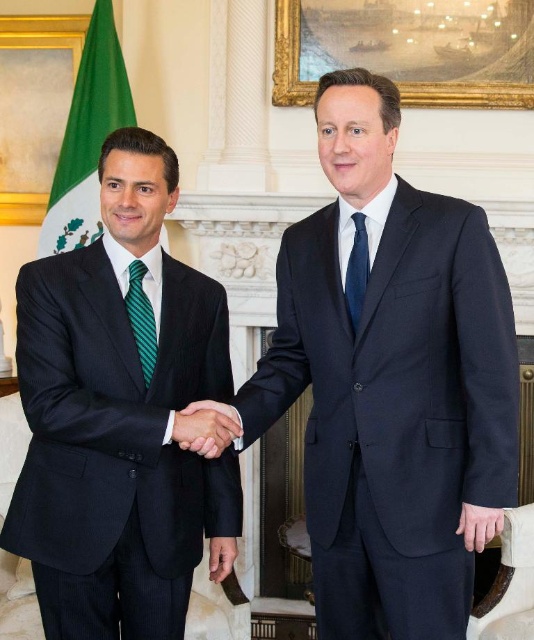
Question: From the image, what is the correct spatial relationship of matte black suit at left in relation to matte black hands at center?

Choices:
 (A) below
 (B) above

Answer: (B)

Question: From the image, what is the correct spatial relationship of matte black suit at left in relation to matte black hands at center?

Choices:
 (A) above
 (B) below

Answer: (A)

Question: Which of these objects is positioned farthest from the matte black hands at center?

Choices:
 (A) navy blue suit at center
 (B) green striped tie at left
 (C) matte black suit at left
 (D) navy silk tie at center

Answer: (D)

Question: Which point is farther from the camera taking this photo?

Choices:
 (A) (227, 422)
 (B) (357, 310)
 (C) (387, 220)

Answer: (B)

Question: Which object is closer to the camera taking this photo?

Choices:
 (A) matte black hands at center
 (B) matte black suit at left

Answer: (B)

Question: Can you confirm if navy blue suit at center is thinner than navy silk tie at center?

Choices:
 (A) yes
 (B) no

Answer: (B)